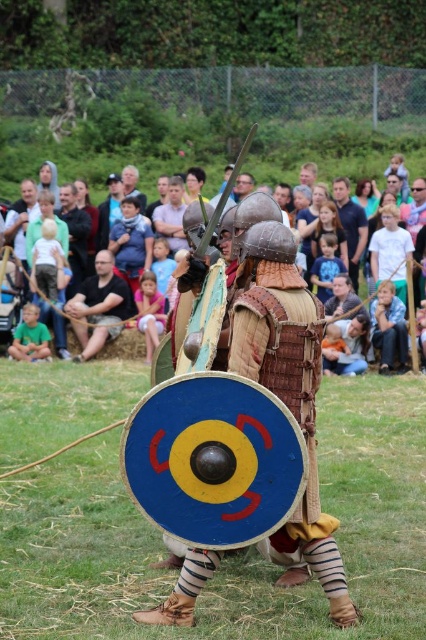
Question: Considering the relative positions of black leather pants at center and brown leather armor at center in the image provided, where is black leather pants at center located with respect to brown leather armor at center?

Choices:
 (A) right
 (B) left

Answer: (B)

Question: Is the position of light brown wooden bench at upper center more distant than that of brown leather armor at center?

Choices:
 (A) yes
 (B) no

Answer: (A)

Question: Which point is closer to the camera taking this photo?

Choices:
 (A) click(354, 250)
 (B) click(77, 300)

Answer: (B)

Question: Can you confirm if light brown wooden bench at upper center is smaller than brown leather armor at center?

Choices:
 (A) no
 (B) yes

Answer: (A)

Question: Which point is closer to the camera taking this photo?

Choices:
 (A) (2, 182)
 (B) (347, 243)

Answer: (B)

Question: Based on their relative distances, which object is nearer to the black leather pants at center?

Choices:
 (A) brown leather armor at center
 (B) light brown wooden bench at upper center

Answer: (A)